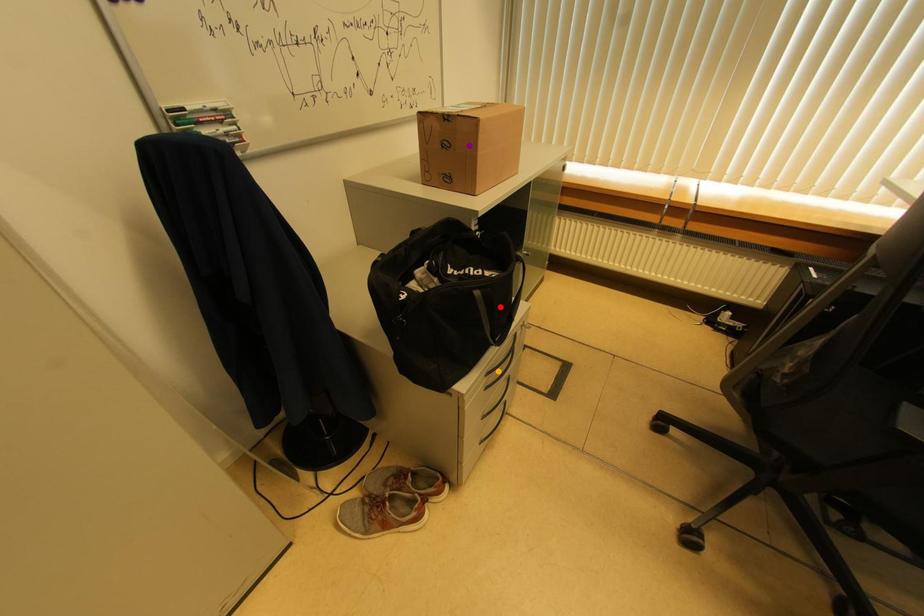
Order these from nearest to farthest:
orange point | red point | purple point

red point
orange point
purple point